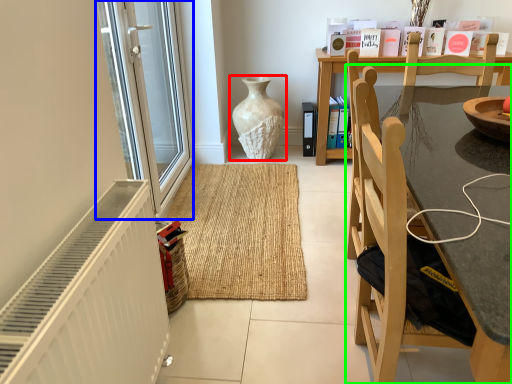
Question: Based on their relative distances, which object is nearer to vase (highlighted by a red box)? Choose from screen door (highlighted by a blue box) and chair (highlighted by a green box).

Choices:
 (A) screen door
 (B) chair

Answer: (A)